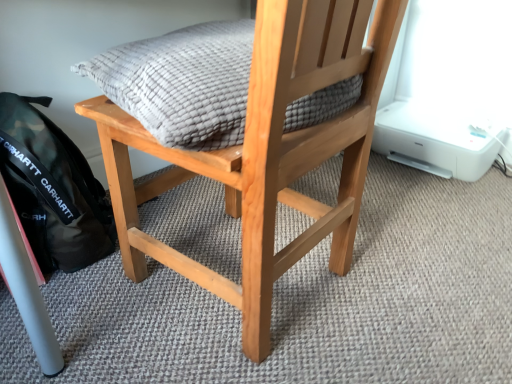
This screenshot has width=512, height=384. Identify the location of natural wood chair at center. (266, 152).

What do you see at coordinates (53, 188) in the screenshot? I see `black matte backpack at lower left` at bounding box center [53, 188].

Where is `natural wood chair at center`? This screenshot has width=512, height=384. natural wood chair at center is located at coordinates (266, 152).

Is the position of natural wood chair at center less distant than that of textured gray cushion at center?

Yes, natural wood chair at center is in front of textured gray cushion at center.

Considering the relative positions of natural wood chair at center and textured gray cushion at center in the image provided, is natural wood chair at center to the left or to the right of textured gray cushion at center?

Clearly, natural wood chair at center is on the left of textured gray cushion at center in the image.

From a real-world perspective, is natural wood chair at center located higher than textured gray cushion at center?

No.

Considering the points (353, 33) and (179, 95), which point is behind, point (353, 33) or point (179, 95)?

The point (353, 33) is more distant.

Which is in front, point (15, 176) or point (193, 107)?

The point (193, 107) is more forward.

The width and height of the screenshot is (512, 384). What are the coordinates of `pillow that is above the black matte backpack at lower left (from the image's perspective)` in the screenshot? It's located at (182, 83).

From the image's perspective, between black matte backpack at lower left and textured gray cushion at center, who is located below?

black matte backpack at lower left, from the image's perspective.

Is textured gray cushion at center further to the viewer compared to natural wood chair at center?

Yes, textured gray cushion at center is behind natural wood chair at center.

Where is `chair located above the textured gray cushion at center (from the image's perspective)`? Image resolution: width=512 pixels, height=384 pixels. chair located above the textured gray cushion at center (from the image's perspective) is located at coordinates (266, 152).

Is textured gray cushion at center facing towards natural wood chair at center?

Yes, textured gray cushion at center is aimed at natural wood chair at center.

Considering the relative sizes of black matte backpack at lower left and natural wood chair at center in the image provided, is black matte backpack at lower left thinner than natural wood chair at center?

Yes, black matte backpack at lower left is thinner than natural wood chair at center.

Which is closer, (x=96, y=181) or (x=292, y=81)?

The point (x=292, y=81) is closer to the camera.

From the image's perspective, which is below, black matte backpack at lower left or natural wood chair at center?

black matte backpack at lower left.

From a real-world perspective, who is located lower, black matte backpack at lower left or natural wood chair at center?

In real-world perspective, black matte backpack at lower left is lower.

Which of these two, textured gray cushion at center or black matte backpack at lower left, stands taller?

black matte backpack at lower left is taller.

Considering the sizes of textured gray cushion at center and black matte backpack at lower left in the image, is textured gray cushion at center wider or thinner than black matte backpack at lower left?

textured gray cushion at center is wider than black matte backpack at lower left.

Identify the location of pillow above the black matte backpack at lower left (from a real-world perspective). This screenshot has width=512, height=384. (182, 83).

Relative to black matte backpack at lower left, is textured gray cushion at center in front or behind?

In the image, textured gray cushion at center appears in front of black matte backpack at lower left.

Does natural wood chair at center appear on the left side of black matte backpack at lower left?

No, natural wood chair at center is not to the left of black matte backpack at lower left.

Which is behind, natural wood chair at center or black matte backpack at lower left?

black matte backpack at lower left is behind.

Is natural wood chair at center in contact with black matte backpack at lower left?

natural wood chair at center and black matte backpack at lower left are clearly separated.

You are a GUI agent. You are given a task and a screenshot of the screen. Output one action in this format:
    pyautogui.click(x=<x>, y=<y>)
    Task: Click on the pillow that is behind the natural wood chair at center
    Image resolution: width=512 pixels, height=384 pixels.
    Given the screenshot: What is the action you would take?
    pyautogui.click(x=182, y=83)

Find the location of `pillow on the right of the black matte backpack at lower left`. pillow on the right of the black matte backpack at lower left is located at coordinates (182, 83).

From the image, which object appears to be farther from natural wood chair at center, black matte backpack at lower left or textured gray cushion at center?

black matte backpack at lower left.

Looking at the image, which one is located closer to black matte backpack at lower left, textured gray cushion at center or natural wood chair at center?

natural wood chair at center is positioned closer to the anchor black matte backpack at lower left.

Which object lies further to the anchor point black matte backpack at lower left, natural wood chair at center or textured gray cushion at center?

Based on the image, textured gray cushion at center appears to be further to black matte backpack at lower left.

When comparing their distances from textured gray cushion at center, does black matte backpack at lower left or natural wood chair at center seem closer?

Among the two, natural wood chair at center is located nearer to textured gray cushion at center.

When comparing their distances from natural wood chair at center, does textured gray cushion at center or black matte backpack at lower left seem closer?

textured gray cushion at center.

Which object lies further to the anchor point textured gray cushion at center, natural wood chair at center or black matte backpack at lower left?

Based on the image, black matte backpack at lower left appears to be further to textured gray cushion at center.

Locate an element on the screen. pillow between natural wood chair at center and black matte backpack at lower left along the z-axis is located at coordinates (182, 83).